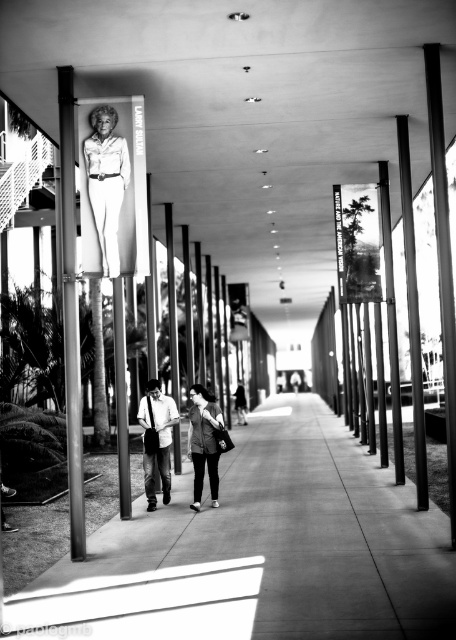
Question: Which point is closer to the camera?

Choices:
 (A) (171, 420)
 (B) (429, 525)
 (C) (72, 369)
 (D) (108, 227)

Answer: (C)

Question: Is metallic pole at left smaller than matte gray jacket at center?

Choices:
 (A) yes
 (B) no

Answer: (B)

Question: Which object appears farthest from the camera in this image?

Choices:
 (A) metallic pole at left
 (B) dark gray sweater at center
 (C) metallic pole at center
 (D) smooth concrete sidewalk at center

Answer: (B)

Question: Can you confirm if dark gray sweater at center is bigger than dark gray jacket at center?

Choices:
 (A) yes
 (B) no

Answer: (A)

Question: Which object appears closest to the camera in this image?

Choices:
 (A) dark gray sweater at center
 (B) metallic pole at left
 (C) dark gray jacket at center
 (D) metallic pole at center

Answer: (B)

Question: Is matte white statue at upper left above matte gray jacket at center?

Choices:
 (A) yes
 (B) no

Answer: (A)